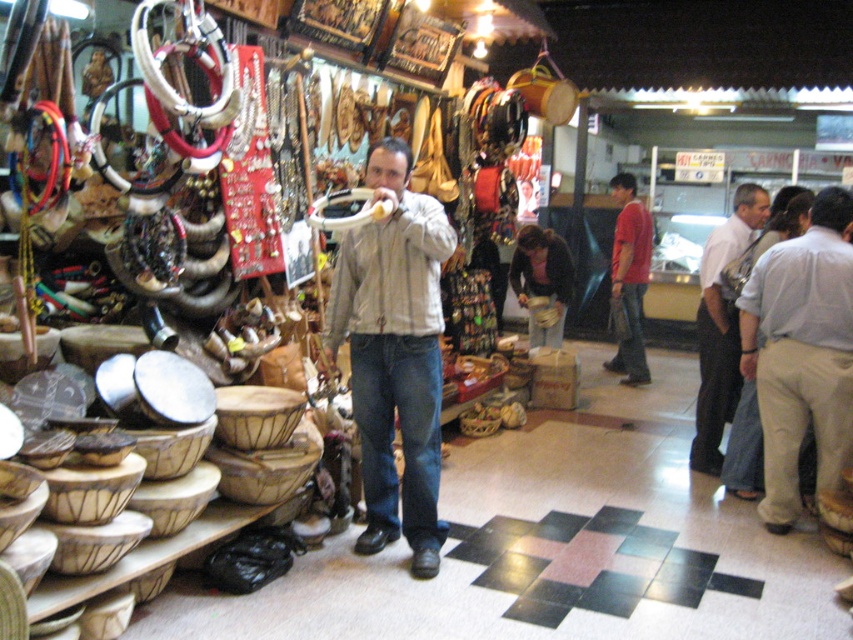
Question: Considering the real-world distances, which object is farthest from the red cotton shirt at center?

Choices:
 (A) light brown leather tie at right
 (B) light gray shirt at center
 (C) light beige jacket at center

Answer: (C)

Question: Can you confirm if light beige jacket at center is bigger than dark brown leather jacket at center?

Choices:
 (A) yes
 (B) no

Answer: (A)

Question: Considering the real-world distances, which object is farthest from the light beige jacket at center?

Choices:
 (A) light gray shirt at center
 (B) red cotton shirt at center
 (C) dark brown leather jacket at center

Answer: (B)

Question: Does light beige jacket at center come behind light brown leather tie at right?

Choices:
 (A) yes
 (B) no

Answer: (B)

Question: Which is nearer to the light beige jacket at center?

Choices:
 (A) light brown leather tie at right
 (B) red cotton shirt at center
 (C) dark brown leather jacket at center

Answer: (A)

Question: Does light gray shirt at center appear under red cotton shirt at center?

Choices:
 (A) yes
 (B) no

Answer: (A)